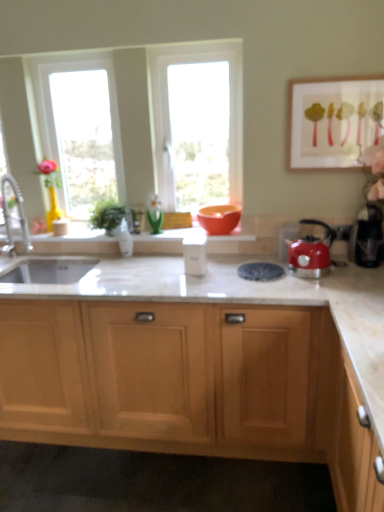
Question: From a real-world perspective, is black plastic coffee machine at right beneath green glass vase at center, the first glass vase positioned from the right?

Choices:
 (A) no
 (B) yes

Answer: (B)

Question: Can you confirm if black plastic coffee machine at right is positioned to the right of green glass vase at center, which appears as the second glass vase when viewed from the left?

Choices:
 (A) yes
 (B) no

Answer: (A)

Question: Is black plastic coffee machine at right facing towards green glass vase at center, the first glass vase positioned from the right?

Choices:
 (A) no
 (B) yes

Answer: (A)

Question: Does black plastic coffee machine at right have a smaller size compared to green glass vase at center, the first glass vase positioned from the right?

Choices:
 (A) yes
 (B) no

Answer: (B)

Question: Is the position of black plastic coffee machine at right less distant than that of green glass vase at center, the first glass vase positioned from the right?

Choices:
 (A) no
 (B) yes

Answer: (B)

Question: Is black plastic coffee machine at right oriented away from green glass vase at center, the first glass vase positioned from the right?

Choices:
 (A) yes
 (B) no

Answer: (B)

Question: Is brushed metal faucet at left surrounded by black plastic coffee machine at right?

Choices:
 (A) no
 (B) yes

Answer: (A)

Question: Is black plastic coffee machine at right looking in the opposite direction of brushed metal faucet at left?

Choices:
 (A) yes
 (B) no

Answer: (B)

Question: Is black plastic coffee machine at right bigger than brushed metal faucet at left?

Choices:
 (A) yes
 (B) no

Answer: (B)

Question: Would you say black plastic coffee machine at right is outside brushed metal faucet at left?

Choices:
 (A) no
 (B) yes

Answer: (B)

Question: From the image's perspective, is black plastic coffee machine at right over brushed metal faucet at left?

Choices:
 (A) no
 (B) yes

Answer: (A)

Question: Is black plastic coffee machine at right beside brushed metal faucet at left?

Choices:
 (A) no
 (B) yes

Answer: (A)

Question: Does wooden framed artwork at upper right have a lesser width compared to transparent glass window at center, positioned as the 2th window in left-to-right order?

Choices:
 (A) yes
 (B) no

Answer: (A)